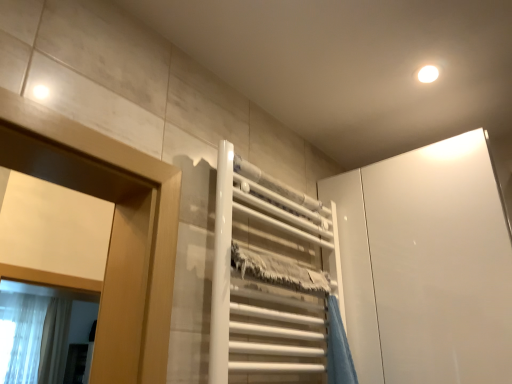
Question: In the image, is translucent fabric shower curtain at lower left on the left side or the right side of white glossy towel rack at center?

Choices:
 (A) left
 (B) right

Answer: (A)

Question: From the image's perspective, relative to white glossy towel rack at center, is translucent fabric shower curtain at lower left above or below?

Choices:
 (A) below
 (B) above

Answer: (A)

Question: Which is nearer to the white glossy towel rack at center?

Choices:
 (A) translucent fabric shower curtain at lower left
 (B) white glossy cabinet at upper right

Answer: (B)

Question: Which object is positioned closest to the white glossy cabinet at upper right?

Choices:
 (A) translucent fabric shower curtain at lower left
 (B) white glossy towel rack at center

Answer: (B)